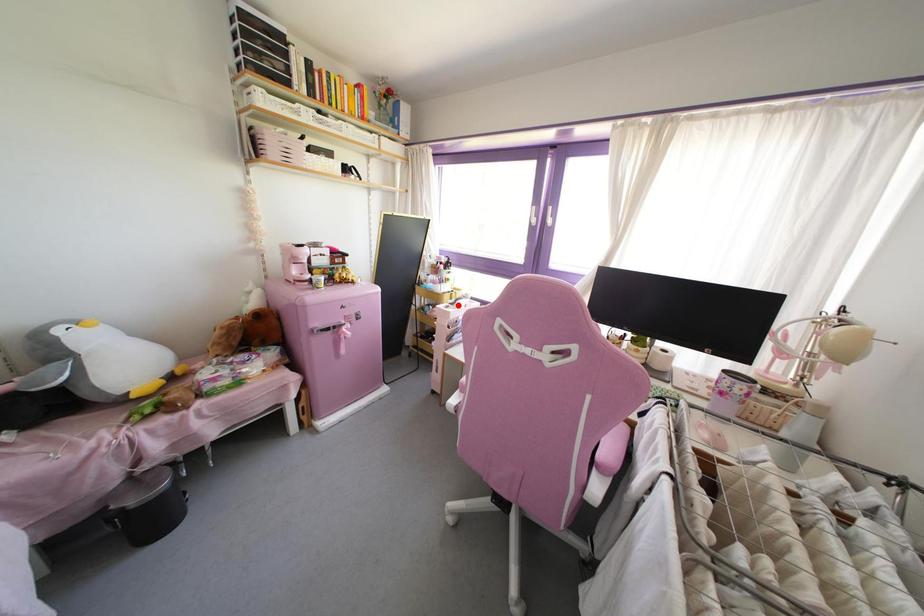
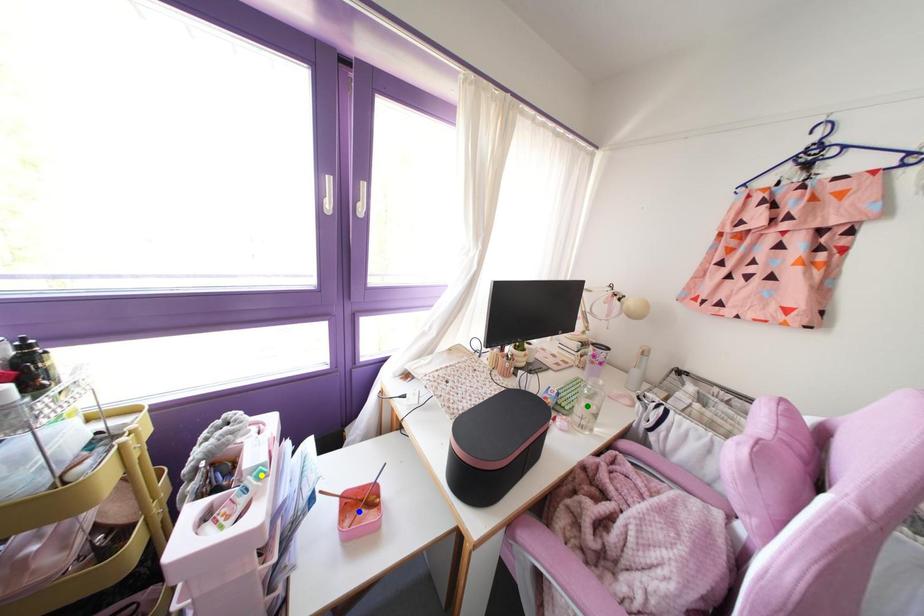
Question: I am providing you with two images of the same scene from different viewpoints. A red point is marked on the first image. You are given multiple points on the second image. Which point in image 2 represents the same 3d spot as the red point in image 1?

Choices:
 (A) yellow point
 (B) blue point
 (C) green point

Answer: (A)